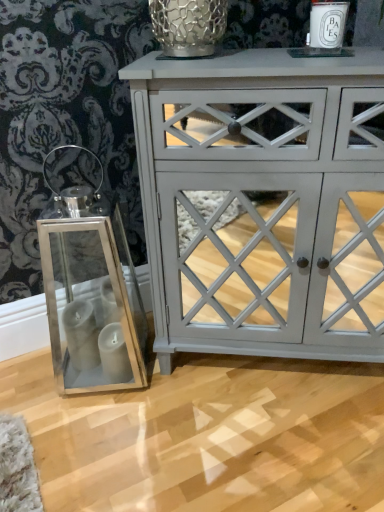
The width and height of the screenshot is (384, 512). I want to click on free space on the front side of metallic mesh glass vase at upper center, so click(201, 69).